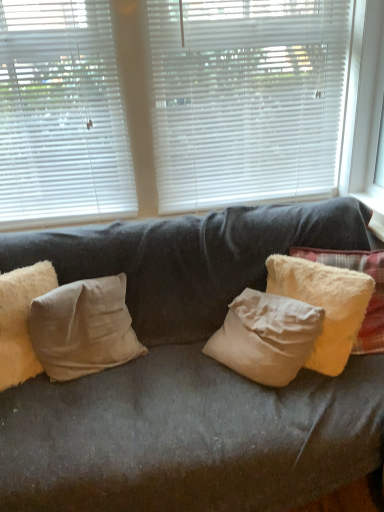
Describe the element at coordinates (61, 116) in the screenshot. I see `white matte blinds at upper left, which is counted as the second window blind, starting from the right` at that location.

What is the approximate width of beige cotton pillow at left, the 2th pillow from the left?

It is 8.75 inches.

Measure the distance between beige cotton pillow at left, the 3th pillow viewed from the right, and camera.

The depth of beige cotton pillow at left, the 3th pillow viewed from the right, is 4.94 feet.

Image resolution: width=384 pixels, height=512 pixels. I want to click on white plastic window frame at upper right, so click(368, 109).

Relative to fuzzy yellow pillow at right, the 1th pillow when ordered from right to left, is white plastic window frame at upper right in front or behind?

In the image, white plastic window frame at upper right appears in front of fuzzy yellow pillow at right, the 1th pillow when ordered from right to left.

From the image's perspective, which is below, white plastic window frame at upper right or fuzzy yellow pillow at right, the 1th pillow when ordered from right to left?

fuzzy yellow pillow at right, the 1th pillow when ordered from right to left.

Is fuzzy yellow pillow at right, the 1th pillow when ordered from right to left, surrounded by white plastic window frame at upper right?

Definitely not — fuzzy yellow pillow at right, the 1th pillow when ordered from right to left, is not inside white plastic window frame at upper right.

Image resolution: width=384 pixels, height=512 pixels. I want to click on window frame above the fuzzy yellow pillow at right, acting as the 3th pillow starting from the left (from the image's perspective), so click(368, 109).

Is beige cotton pillow at left, the first pillow from the left, positioned with its back to fuzzy yellow pillow at right, acting as the 3th pillow starting from the left?

No, beige cotton pillow at left, the first pillow from the left,'s orientation is not away from fuzzy yellow pillow at right, acting as the 3th pillow starting from the left.

From the image's perspective, which one is positioned lower, beige cotton pillow at left, the first pillow from the left, or fuzzy yellow pillow at right, acting as the 3th pillow starting from the left?

beige cotton pillow at left, the first pillow from the left, from the image's perspective.

Is beige cotton pillow at left, the 3th pillow viewed from the right, placed right next to fuzzy yellow pillow at right, the 1th pillow when ordered from right to left?

No, beige cotton pillow at left, the 3th pillow viewed from the right, is not with fuzzy yellow pillow at right, the 1th pillow when ordered from right to left.

From a real-world perspective, which object stands above the other?

In real-world perspective, beige cotton pillow at left, the first pillow from the left, is above.

Looking at the image, does beige cotton pillow at left, the 2th pillow from the left, seem bigger or smaller compared to white matte blinds at upper left, which is counted as the second window blind, starting from the right?

beige cotton pillow at left, the 2th pillow from the left, is smaller than white matte blinds at upper left, which is counted as the second window blind, starting from the right.

From the image's perspective, which is below, beige cotton pillow at left, positioned as the second pillow in right-to-left order, or white matte blinds at upper left, the 1th window blind when ordered from left to right?

beige cotton pillow at left, positioned as the second pillow in right-to-left order, appears lower in the image.

Does beige cotton pillow at left, positioned as the second pillow in right-to-left order, have a lesser width compared to white matte blinds at upper left, the 1th window blind when ordered from left to right?

No.

Can you tell me how much white matte blinds at upper left, which is counted as the second window blind, starting from the right, and fuzzy yellow pillow at right, acting as the 3th pillow starting from the left, differ in facing direction?

45.9 degrees separate the facing orientations of white matte blinds at upper left, which is counted as the second window blind, starting from the right, and fuzzy yellow pillow at right, acting as the 3th pillow starting from the left.

Does white matte blinds at upper left, which is counted as the second window blind, starting from the right, have a greater height compared to fuzzy yellow pillow at right, the 1th pillow when ordered from right to left?

Indeed, white matte blinds at upper left, which is counted as the second window blind, starting from the right, has a greater height compared to fuzzy yellow pillow at right, the 1th pillow when ordered from right to left.

Which object is more forward, white matte blinds at upper left, the 1th window blind when ordered from left to right, or fuzzy yellow pillow at right, the 1th pillow when ordered from right to left?

fuzzy yellow pillow at right, the 1th pillow when ordered from right to left, is closer to the camera.

Are white matte blinds at upper left, the 1th window blind when ordered from left to right, and fuzzy yellow pillow at right, the 1th pillow when ordered from right to left, beside each other?

No, white matte blinds at upper left, the 1th window blind when ordered from left to right, is not next to fuzzy yellow pillow at right, the 1th pillow when ordered from right to left.

Is fuzzy yellow pillow at right, acting as the 3th pillow starting from the left, positioned beyond the bounds of beige cotton pillow at left, the 2th pillow from the left?

Yes, fuzzy yellow pillow at right, acting as the 3th pillow starting from the left, is not within beige cotton pillow at left, the 2th pillow from the left.

From the picture: Does fuzzy yellow pillow at right, acting as the 3th pillow starting from the left, have a greater width compared to beige cotton pillow at left, positioned as the second pillow in right-to-left order?

Yes, fuzzy yellow pillow at right, acting as the 3th pillow starting from the left, is wider than beige cotton pillow at left, positioned as the second pillow in right-to-left order.

Which object is positioned more to the left, fuzzy yellow pillow at right, acting as the 3th pillow starting from the left, or beige cotton pillow at left, positioned as the second pillow in right-to-left order?

Positioned to the left is beige cotton pillow at left, positioned as the second pillow in right-to-left order.

Which is closer, (298, 288) or (62, 302)?

Point (298, 288).

Is fuzzy yellow pillow at right, acting as the 3th pillow starting from the left, not close to white matte blinds at upper left, the 1th window blind when ordered from left to right?

Absolutely, fuzzy yellow pillow at right, acting as the 3th pillow starting from the left, is distant from white matte blinds at upper left, the 1th window blind when ordered from left to right.

Considering the points (368, 294) and (27, 209), which point is behind, point (368, 294) or point (27, 209)?

The point (27, 209) is farther from the camera.

Considering the sizes of objects fuzzy yellow pillow at right, acting as the 3th pillow starting from the left, and white matte blinds at upper left, the 1th window blind when ordered from left to right, in the image provided, who is bigger, fuzzy yellow pillow at right, acting as the 3th pillow starting from the left, or white matte blinds at upper left, the 1th window blind when ordered from left to right,?

Bigger between the two is fuzzy yellow pillow at right, acting as the 3th pillow starting from the left.

From a real-world perspective, is fuzzy yellow pillow at right, the 1th pillow when ordered from right to left, located higher than white matte blinds at upper left, which is counted as the second window blind, starting from the right?

Actually, fuzzy yellow pillow at right, the 1th pillow when ordered from right to left, is physically below white matte blinds at upper left, which is counted as the second window blind, starting from the right, in the real world.

Considering the positions of points (348, 179) and (55, 64), is point (348, 179) farther from camera compared to point (55, 64)?

Yes.

Would you say white plastic window frame at upper right is a long distance from white matte blinds at upper center, which is counted as the first window blind, starting from the right?

No, there isn't a large distance between white plastic window frame at upper right and white matte blinds at upper center, which is counted as the first window blind, starting from the right.

Considering the positions of objects white plastic window frame at upper right and white matte blinds at upper center, positioned as the 2th window blind in left-to-right order, in the image provided, who is more to the left, white plastic window frame at upper right or white matte blinds at upper center, positioned as the 2th window blind in left-to-right order,?

Positioned to the left is white matte blinds at upper center, positioned as the 2th window blind in left-to-right order.

I want to click on the 1st pillow to the left when counting from the white plastic window frame at upper right, so click(x=324, y=304).

From a real-world perspective, which pillow is the 2nd one above the fuzzy yellow pillow at right, the 1th pillow when ordered from right to left? Please provide its 2D coordinates.

[(21, 320)]

Estimate the real-world distances between objects in this image. Which object is closer to beige cotton pillow at left, the 2th pillow from the left, white matte blinds at upper left, the 1th window blind when ordered from left to right, or beige cotton pillow at left, the first pillow from the left?

Based on the image, beige cotton pillow at left, the first pillow from the left, appears to be nearer to beige cotton pillow at left, the 2th pillow from the left.

Which object lies nearer to the anchor point beige cotton pillow at left, positioned as the second pillow in right-to-left order, white matte blinds at upper left, which is counted as the second window blind, starting from the right, or white matte blinds at upper center, which is counted as the first window blind, starting from the right?

Based on the image, white matte blinds at upper left, which is counted as the second window blind, starting from the right, appears to be nearer to beige cotton pillow at left, positioned as the second pillow in right-to-left order.

From the image, which object appears to be nearer to fuzzy yellow pillow at right, acting as the 3th pillow starting from the left, beige cotton pillow at left, the 2th pillow from the left, or white plastic window frame at upper right?

The object closer to fuzzy yellow pillow at right, acting as the 3th pillow starting from the left, is white plastic window frame at upper right.

Looking at the image, which one is located further to beige cotton pillow at left, positioned as the second pillow in right-to-left order, beige cotton pillow at left, the first pillow from the left, or white matte blinds at upper left, the 1th window blind when ordered from left to right?

The object further to beige cotton pillow at left, positioned as the second pillow in right-to-left order, is white matte blinds at upper left, the 1th window blind when ordered from left to right.

From the image, which object appears to be nearer to white plastic window frame at upper right, white matte blinds at upper center, positioned as the 2th window blind in left-to-right order, or fuzzy yellow pillow at right, the 1th pillow when ordered from right to left?

Among the two, fuzzy yellow pillow at right, the 1th pillow when ordered from right to left, is located nearer to white plastic window frame at upper right.

Looking at the image, which one is located further to white matte blinds at upper left, which is counted as the second window blind, starting from the right, beige cotton pillow at left, the 3th pillow viewed from the right, or beige cotton pillow at left, the 2th pillow from the left?

beige cotton pillow at left, the 2th pillow from the left, is positioned further to the anchor white matte blinds at upper left, which is counted as the second window blind, starting from the right.

When comparing their distances from fuzzy yellow pillow at right, acting as the 3th pillow starting from the left, does white matte blinds at upper left, the 1th window blind when ordered from left to right, or white plastic window frame at upper right seem further?

white matte blinds at upper left, the 1th window blind when ordered from left to right.

Which object lies nearer to the anchor point beige cotton pillow at left, the first pillow from the left, beige cotton pillow at left, positioned as the second pillow in right-to-left order, or white matte blinds at upper left, which is counted as the second window blind, starting from the right?

Based on the image, beige cotton pillow at left, positioned as the second pillow in right-to-left order, appears to be nearer to beige cotton pillow at left, the first pillow from the left.

This screenshot has width=384, height=512. I want to click on pillow between white matte blinds at upper left, the 1th window blind when ordered from left to right, and fuzzy yellow pillow at right, acting as the 3th pillow starting from the left, in the horizontal direction, so click(83, 328).

Identify the location of window frame between white matte blinds at upper center, which is counted as the first window blind, starting from the right, and fuzzy yellow pillow at right, acting as the 3th pillow starting from the left, vertically. click(368, 109).

Locate an element on the screen. The width and height of the screenshot is (384, 512). pillow between beige cotton pillow at left, the 3th pillow viewed from the right, and fuzzy yellow pillow at right, acting as the 3th pillow starting from the left, from left to right is located at coordinates (83, 328).

Find the location of a particular element. The image size is (384, 512). window blind between white matte blinds at upper center, positioned as the 2th window blind in left-to-right order, and beige cotton pillow at left, the 2th pillow from the left, vertically is located at coordinates (61, 116).